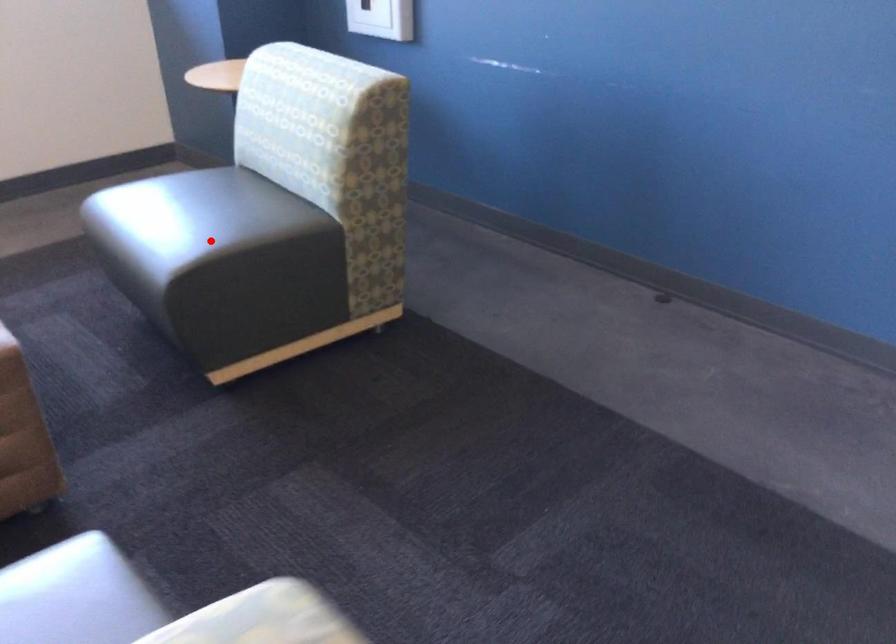
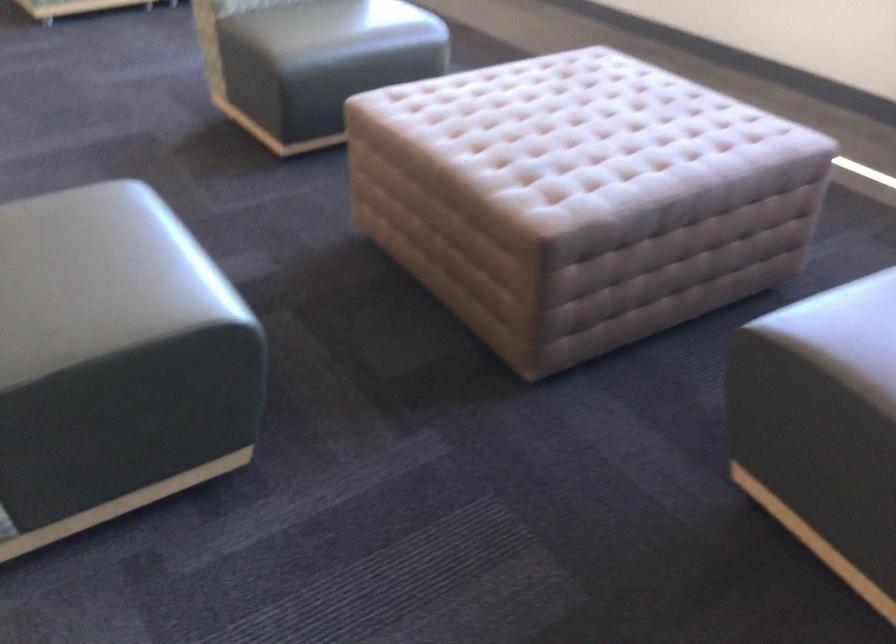
Where in the second image is the point corresponding to the highlighted location from the first image?

(846, 335)